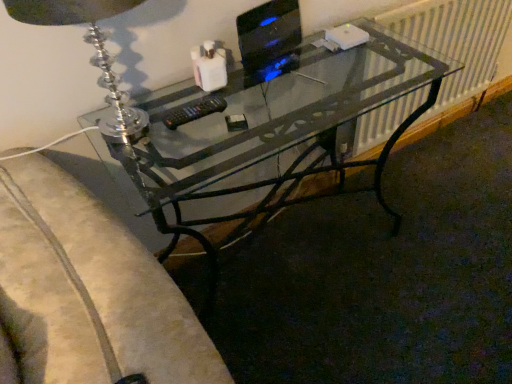
You are a GUI agent. You are given a task and a screenshot of the screen. Output one action in this format:
    pyautogui.click(x=<x>, y=<y>)
    Task: Click on the black glossy monitor at upper right
    This screenshot has height=384, width=512.
    Given the screenshot: What is the action you would take?
    pyautogui.click(x=269, y=34)

Does black plastic remote at center touch clear glass table lamp at upper left?

black plastic remote at center and clear glass table lamp at upper left are not in contact.

Is point (177, 127) less distant than point (72, 4)?

No, (177, 127) is behind (72, 4).

From the picture: Who is smaller, black plastic remote at center or clear glass table lamp at upper left?

black plastic remote at center is smaller.

From a real-world perspective, is black plastic remote at center physically below clear glass table lamp at upper left?

Yes, from a real-world perspective, black plastic remote at center is below clear glass table lamp at upper left.

Relative to black plastic remote at center, is black glossy monitor at upper right in front or behind?

Clearly, black glossy monitor at upper right is behind black plastic remote at center.

From the image's perspective, between black glossy monitor at upper right and black plastic remote at center, which one is located above?

black glossy monitor at upper right, from the image's perspective.

Where is `control in front of the black glossy monitor at upper right`? control in front of the black glossy monitor at upper right is located at coordinates (194, 111).

Can you confirm if clear glass table lamp at upper left is thinner than black plastic remote at center?

No.

Is point (102, 4) farther from viewer compared to point (176, 117)?

That is False.

From a real-world perspective, relative to transparent glass desk at center, is black plastic remote at center vertically above or below?

From a real-world perspective, black plastic remote at center is physically above transparent glass desk at center.

Is point (220, 100) positioned before point (252, 94)?

Yes, it is.

Based on the photo, from the image's perspective, is black plastic remote at center under transparent glass desk at center?

Incorrect, from the image's perspective, black plastic remote at center is higher than transparent glass desk at center.

Does black plastic remote at center come in front of transparent glass desk at center?

No, black plastic remote at center is behind transparent glass desk at center.

Is metallic silver radiator at right facing towards clear glass table lamp at upper left?

No.

From the image's perspective, is metallic silver radiator at right located beneath clear glass table lamp at upper left?

No, from the image's perspective, metallic silver radiator at right is not below clear glass table lamp at upper left.

Would you say metallic silver radiator at right is outside black glossy monitor at upper right?

metallic silver radiator at right lies outside black glossy monitor at upper right's area.

Is metallic silver radiator at right thinner than black glossy monitor at upper right?

Yes, metallic silver radiator at right is thinner than black glossy monitor at upper right.

From the image's perspective, between metallic silver radiator at right and black glossy monitor at upper right, which one is located above?

metallic silver radiator at right, from the image's perspective.

Looking at this image, who is taller, metallic silver radiator at right or black glossy monitor at upper right?

Standing taller between the two is metallic silver radiator at right.

From the image's perspective, is transparent glass desk at center located above or below black glossy monitor at upper right?

Based on their image positions, transparent glass desk at center is located beneath black glossy monitor at upper right.

This screenshot has width=512, height=384. I want to click on computer monitor above the transparent glass desk at center (from the image's perspective), so click(269, 34).

From a real-world perspective, is transparent glass desk at center physically located above or below black glossy monitor at upper right?

In terms of real-world spatial position, transparent glass desk at center is below black glossy monitor at upper right.

Locate an element on the screen. This screenshot has width=512, height=384. control behind the clear glass table lamp at upper left is located at coordinates (194, 111).

This screenshot has height=384, width=512. I want to click on control beneath the black glossy monitor at upper right (from a real-world perspective), so click(194, 111).

Looking at the image, which one is located further to transparent glass desk at center, black glossy monitor at upper right or metallic silver radiator at right?

metallic silver radiator at right.

From the image, which object appears to be farther from clear glass table lamp at upper left, black plastic remote at center or black glossy monitor at upper right?

black glossy monitor at upper right.

Estimate the real-world distances between objects in this image. Which object is further from black glossy monitor at upper right, transparent glass desk at center or metallic silver radiator at right?

Among the two, metallic silver radiator at right is located further to black glossy monitor at upper right.

Which object lies nearer to the anchor point black glossy monitor at upper right, clear glass table lamp at upper left or transparent glass desk at center?

transparent glass desk at center.

From the picture: Considering their positions, is black glossy monitor at upper right positioned closer to transparent glass desk at center than black plastic remote at center?

black glossy monitor at upper right lies closer to transparent glass desk at center than the other object.

Which object lies nearer to the anchor point metallic silver radiator at right, black plastic remote at center or clear glass table lamp at upper left?

black plastic remote at center lies closer to metallic silver radiator at right than the other object.

Estimate the real-world distances between objects in this image. Which object is closer to black plastic remote at center, metallic silver radiator at right or clear glass table lamp at upper left?

Based on the image, clear glass table lamp at upper left appears to be nearer to black plastic remote at center.

Based on their spatial positions, is black glossy monitor at upper right or transparent glass desk at center closer to black plastic remote at center?

black glossy monitor at upper right is closer to black plastic remote at center.

Image resolution: width=512 pixels, height=384 pixels. I want to click on control between clear glass table lamp at upper left and metallic silver radiator at right, so click(194, 111).

Where is `computer monitor between clear glass table lamp at upper left and metallic silver radiator at right in the horizontal direction`? computer monitor between clear glass table lamp at upper left and metallic silver radiator at right in the horizontal direction is located at coordinates (269, 34).

I want to click on control between black glossy monitor at upper right and transparent glass desk at center vertically, so click(x=194, y=111).

You are a GUI agent. You are given a task and a screenshot of the screen. Output one action in this format:
    pyautogui.click(x=<x>, y=<y>)
    Task: Click on the control between clear glass table lamp at upper left and transparent glass desk at center in the horizontal direction
    Image resolution: width=512 pixels, height=384 pixels.
    Given the screenshot: What is the action you would take?
    pyautogui.click(x=194, y=111)